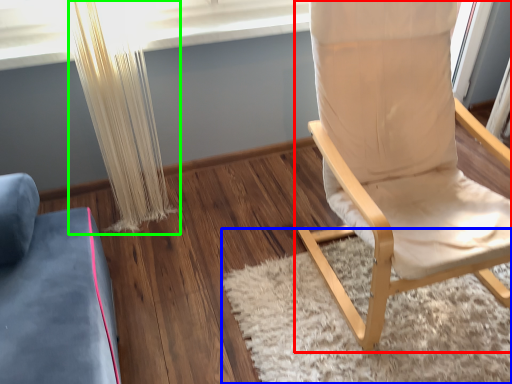
Question: Considering the real-world distances, which object is farthest from chair (highlighted by a red box)? mat (highlighted by a blue box) or curtain (highlighted by a green box)?

Choices:
 (A) mat
 (B) curtain

Answer: (B)